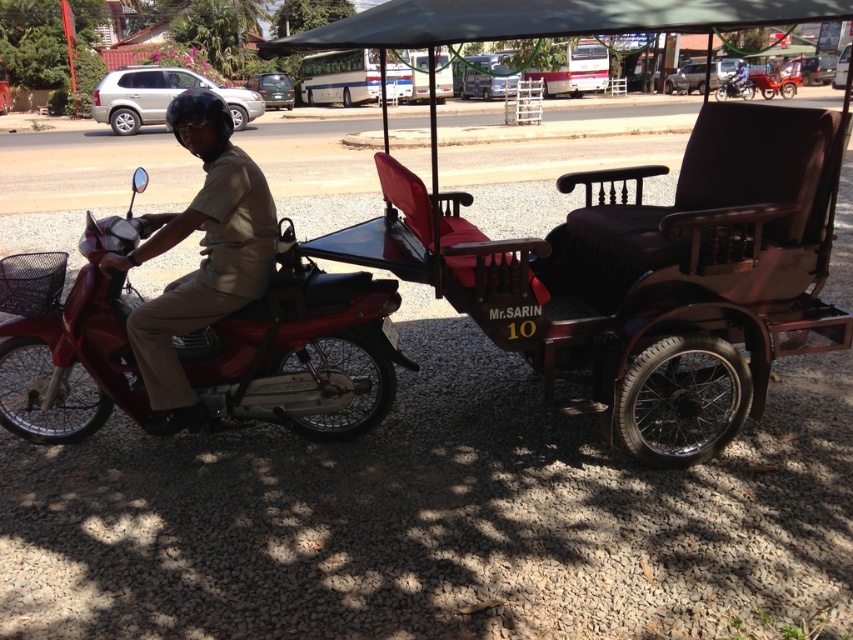
Question: Does matte khaki uniform at left appear over metallic silver motorcycle at center?

Choices:
 (A) yes
 (B) no

Answer: (B)

Question: Which is farther from the shiny red motorcycle at left?

Choices:
 (A) metallic silver motorcycle at center
 (B) matte khaki uniform at left

Answer: (A)

Question: Does shiny red motorcycle at left appear on the right side of matte khaki uniform at left?

Choices:
 (A) no
 (B) yes

Answer: (A)

Question: Which point is farther from the camera taking this photo?

Choices:
 (A) (749, 88)
 (B) (36, 330)

Answer: (A)

Question: Is shiny red motorcycle at left positioned behind metallic silver motorcycle at center?

Choices:
 (A) yes
 (B) no

Answer: (B)

Question: Which object is farther from the camera taking this photo?

Choices:
 (A) matte khaki uniform at left
 (B) shiny red motorcycle at left
 (C) metallic silver motorcycle at center

Answer: (C)